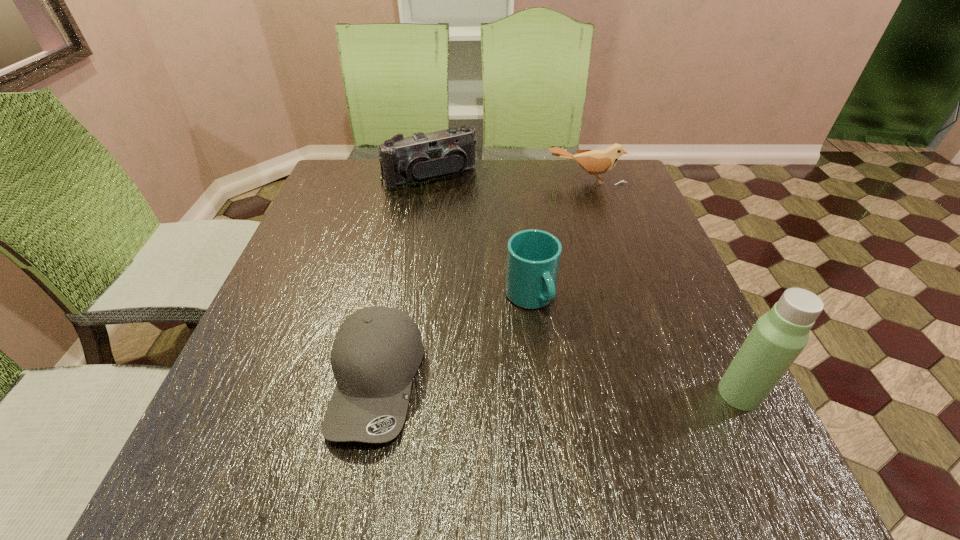
At what (x,y) coordinates should I click in order to perform the action: click on vacant space in between the thermos bottle and the baseball cap. Please return your answer as a coordinate pair (x, y). Looking at the image, I should click on (558, 387).

Find the location of a particular element. The width and height of the screenshot is (960, 540). object that is the fourth closest to the baseball cap is located at coordinates [595, 162].

Where is `the third closest object to the tallest object`? This screenshot has height=540, width=960. the third closest object to the tallest object is located at coordinates (595, 162).

Where is `vacant point that satisfies the following two spatial constraints: 1. on the back side of the cup; 2. on the right side of the bird`? Image resolution: width=960 pixels, height=540 pixels. vacant point that satisfies the following two spatial constraints: 1. on the back side of the cup; 2. on the right side of the bird is located at coordinates (516, 180).

At what (x,y) coordinates should I click in order to perform the action: click on free spot that satisfies the following two spatial constraints: 1. on the front brim of the thermos bottle; 2. on the left side of the baseball cap. Please return your answer as a coordinate pair (x, y). Looking at the image, I should click on (374, 394).

Image resolution: width=960 pixels, height=540 pixels. Find the location of `free space in the image that satisfies the following two spatial constraints: 1. on the front side of the camcorder; 2. on the left side of the thermos bottle`. free space in the image that satisfies the following two spatial constraints: 1. on the front side of the camcorder; 2. on the left side of the thermos bottle is located at coordinates (396, 394).